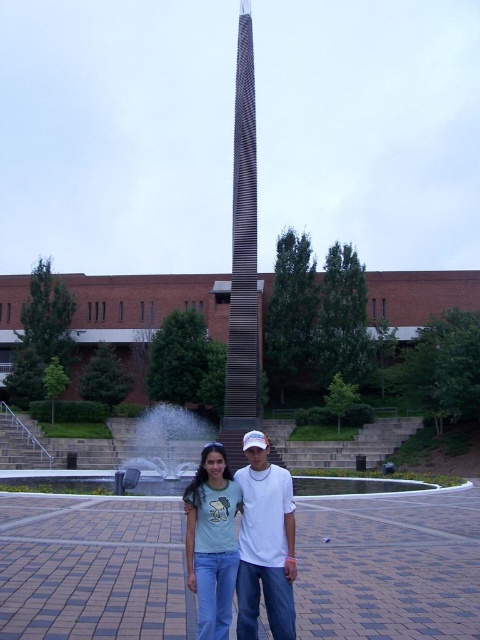
Question: Is carbon fiber tower at center below white glossy water at center?

Choices:
 (A) yes
 (B) no

Answer: (B)

Question: Considering the relative positions of light green cotton shirt at center and white glossy water at center in the image provided, where is light green cotton shirt at center located with respect to white glossy water at center?

Choices:
 (A) right
 (B) left

Answer: (A)

Question: Which is farther from the light blue jeans at center?

Choices:
 (A) light green cotton shirt at center
 (B) carbon fiber tower at center
 (C) white glossy water at center

Answer: (B)

Question: Which point is closer to the camera?

Choices:
 (A) carbon fiber tower at center
 (B) light blue jeans at center

Answer: (B)

Question: Which point is closer to the camera taking this photo?

Choices:
 (A) (233, 140)
 (B) (271, 465)
 (C) (170, 448)

Answer: (B)

Question: Does light blue jeans at center have a lesser width compared to light green cotton shirt at center?

Choices:
 (A) no
 (B) yes

Answer: (A)